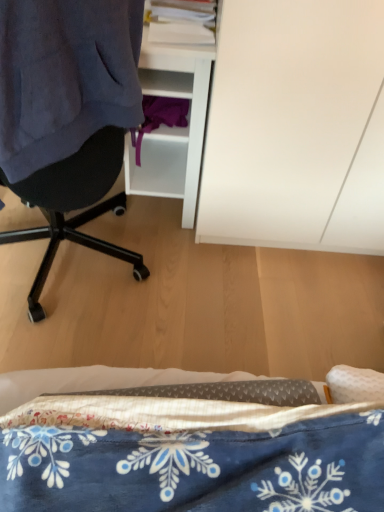
Question: Could you tell me if white matte cabinet at upper right is turned towards dark blue fabric at left?

Choices:
 (A) yes
 (B) no

Answer: (B)

Question: Can you confirm if white matte cabinet at upper right is smaller than dark blue fabric at left?

Choices:
 (A) yes
 (B) no

Answer: (B)

Question: From the image's perspective, is white matte cabinet at upper right located beneath dark blue fabric at left?

Choices:
 (A) no
 (B) yes

Answer: (A)

Question: Is white matte cabinet at upper right positioned beyond the bounds of dark blue fabric at left?

Choices:
 (A) yes
 (B) no

Answer: (A)

Question: Does white matte cabinet at upper right have a larger size compared to dark blue fabric at left?

Choices:
 (A) yes
 (B) no

Answer: (A)

Question: Visually, is dark blue fabric at left positioned to the left or to the right of blue printed fabric at lower center?

Choices:
 (A) left
 (B) right

Answer: (A)

Question: Is point (8, 23) closer or farther from the camera than point (205, 421)?

Choices:
 (A) closer
 (B) farther

Answer: (B)

Question: Choose the correct answer: Is dark blue fabric at left inside blue printed fabric at lower center or outside it?

Choices:
 (A) outside
 (B) inside

Answer: (A)

Question: From a real-world perspective, is dark blue fabric at left physically located above or below blue printed fabric at lower center?

Choices:
 (A) above
 (B) below

Answer: (A)

Question: Is white matte cabinet at upper right inside or outside of blue printed fabric at lower center?

Choices:
 (A) outside
 (B) inside

Answer: (A)

Question: Visually, is white matte cabinet at upper right positioned to the left or to the right of blue printed fabric at lower center?

Choices:
 (A) left
 (B) right

Answer: (B)

Question: Is white matte cabinet at upper right wider or thinner than blue printed fabric at lower center?

Choices:
 (A) wide
 (B) thin

Answer: (A)

Question: Based on their sizes in the image, would you say white matte cabinet at upper right is bigger or smaller than blue printed fabric at lower center?

Choices:
 (A) small
 (B) big

Answer: (B)

Question: Which is correct: white matte cabinet at upper right is inside dark blue fabric at left, or outside of it?

Choices:
 (A) inside
 (B) outside

Answer: (B)

Question: From the image's perspective, is white matte cabinet at upper right above or below dark blue fabric at left?

Choices:
 (A) above
 (B) below

Answer: (A)